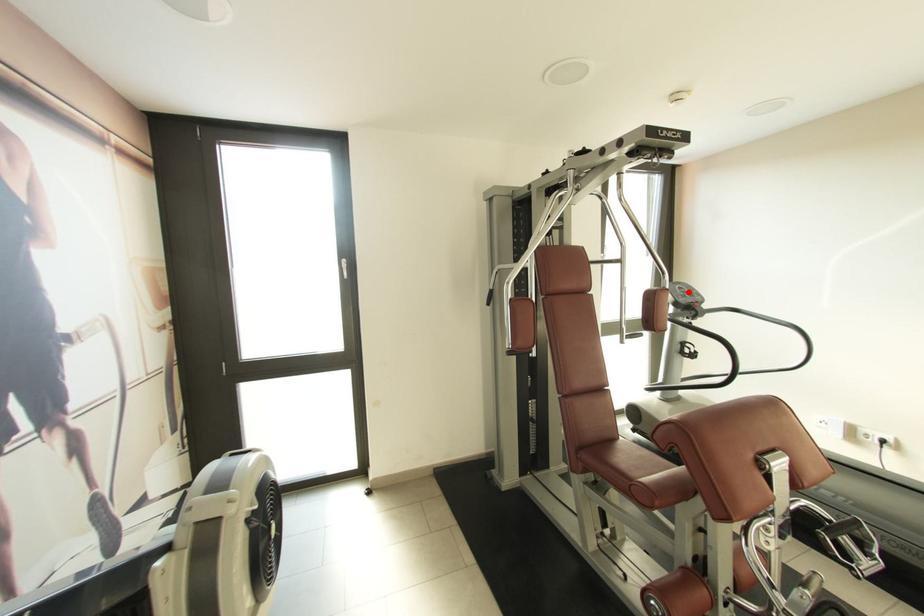
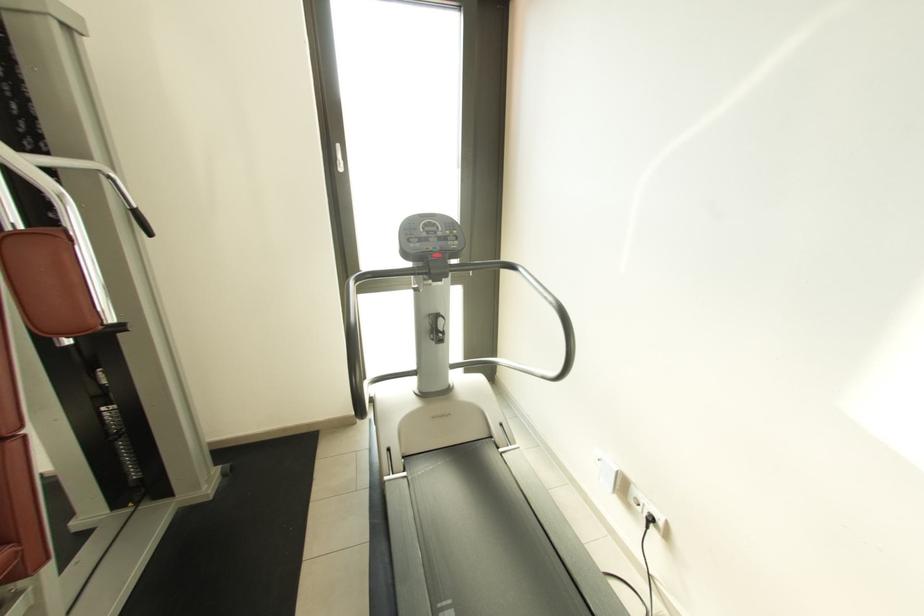
Where in the second image is the point corresponding to the highlighted location from the first image?

(439, 230)